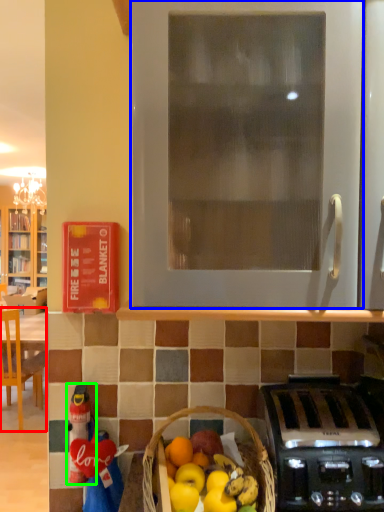
Question: Based on their relative distances, which object is nearer to chair (highlighted by a red box)? Choose from oven (highlighted by a blue box) and toy (highlighted by a green box).

Choices:
 (A) oven
 (B) toy

Answer: (B)